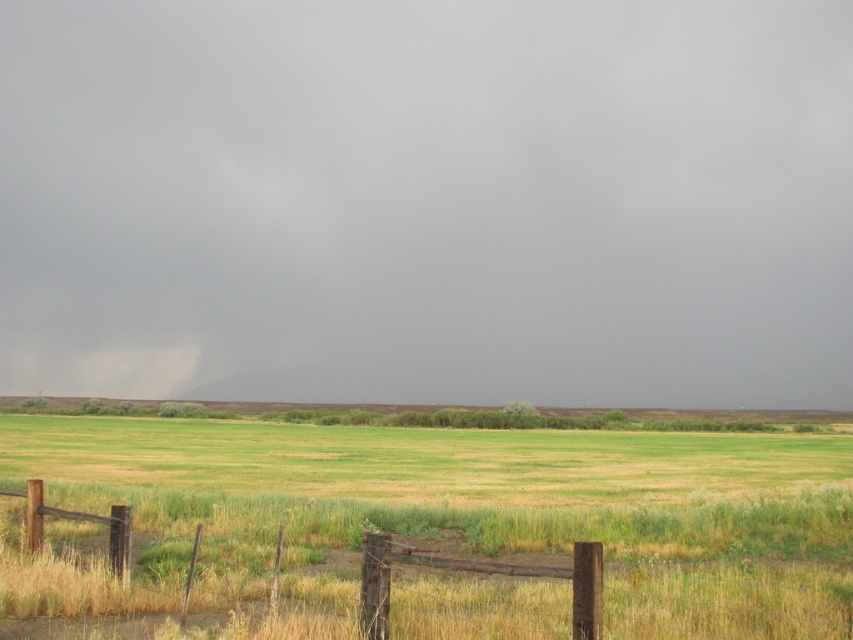
Between wooden fence at lower center and gray cotton cloud at upper left, which one appears on the right side from the viewer's perspective?

wooden fence at lower center is more to the right.

In the scene shown: Who is positioned more to the left, wooden fence at lower center or gray cotton cloud at upper left?

Positioned to the left is gray cotton cloud at upper left.

You are a GUI agent. You are given a task and a screenshot of the screen. Output one action in this format:
    pyautogui.click(x=<x>, y=<y>)
    Task: Click on the wooden fence at lower center
    The image size is (853, 640).
    Given the screenshot: What is the action you would take?
    tap(444, 566)

This screenshot has height=640, width=853. In order to click on wooden fence at lower center in this screenshot , I will do `click(444, 566)`.

Does dark gray cloud at center have a greater width compared to gray cotton cloud at upper left?

Yes.

Can you confirm if dark gray cloud at center is positioned below gray cotton cloud at upper left?

No, dark gray cloud at center is not below gray cotton cloud at upper left.

Where is `dark gray cloud at center`? dark gray cloud at center is located at coordinates (437, 196).

Which is in front, point (244, 99) or point (97, 564)?

Positioned in front is point (97, 564).

Can you confirm if dark gray cloud at center is positioned to the left of wooden fence at lower center?

Incorrect, dark gray cloud at center is not on the left side of wooden fence at lower center.

Is point (57, 182) farther from viewer compared to point (413, 618)?

Yes, it is.

Image resolution: width=853 pixels, height=640 pixels. In order to click on dark gray cloud at center in this screenshot , I will do `click(437, 196)`.